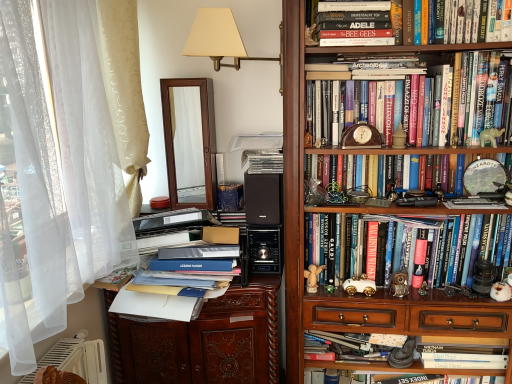
Locate an element on the screen. The image size is (512, 384). empty space that is ontop of blue matte book at center, acting as the second paperback book starting from the top (from a real-world perspective) is located at coordinates coord(194,253).